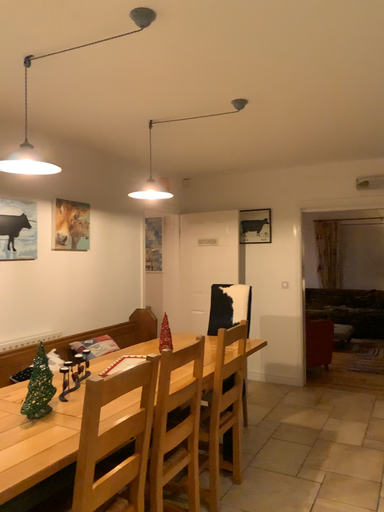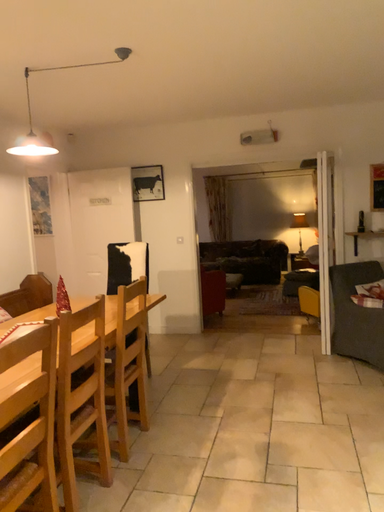
Question: How did the camera likely rotate when shooting the video?

Choices:
 (A) rotated right
 (B) rotated left

Answer: (A)